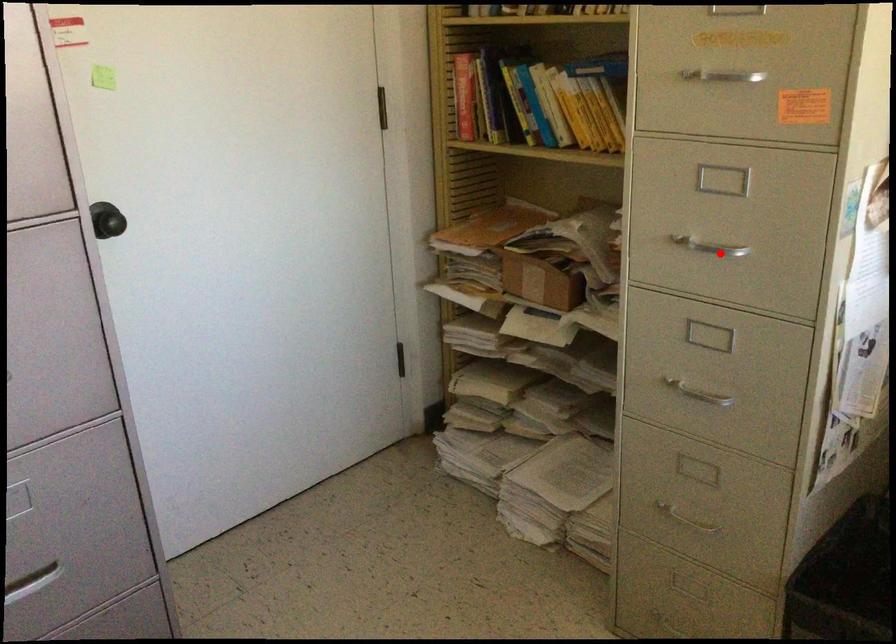
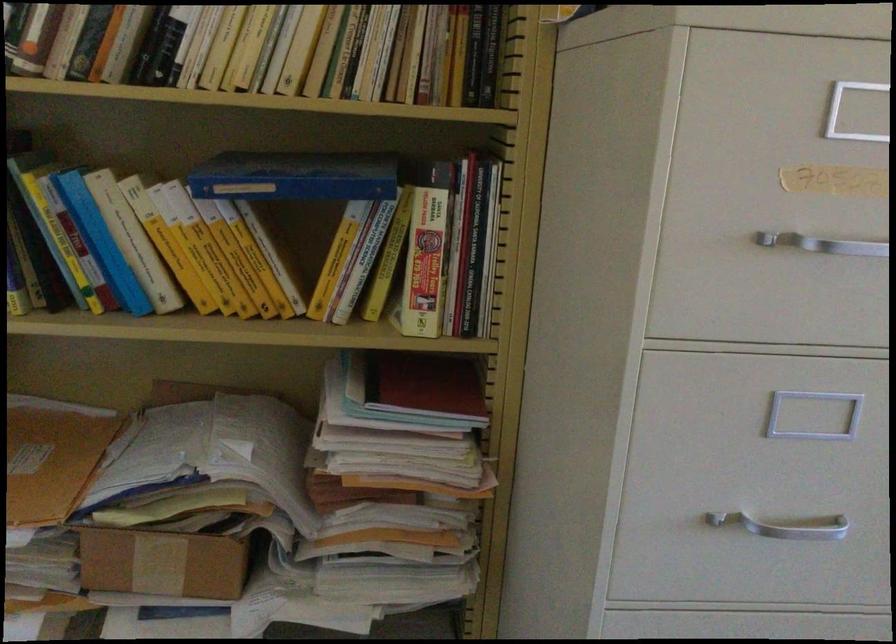
Question: I am providing you with two images of the same scene from different viewpoints. A red point is shown in image1. For the corresponding object point in image2, is it positioned nearer or farther from the camera?

Choices:
 (A) Nearer
 (B) Farther

Answer: (A)